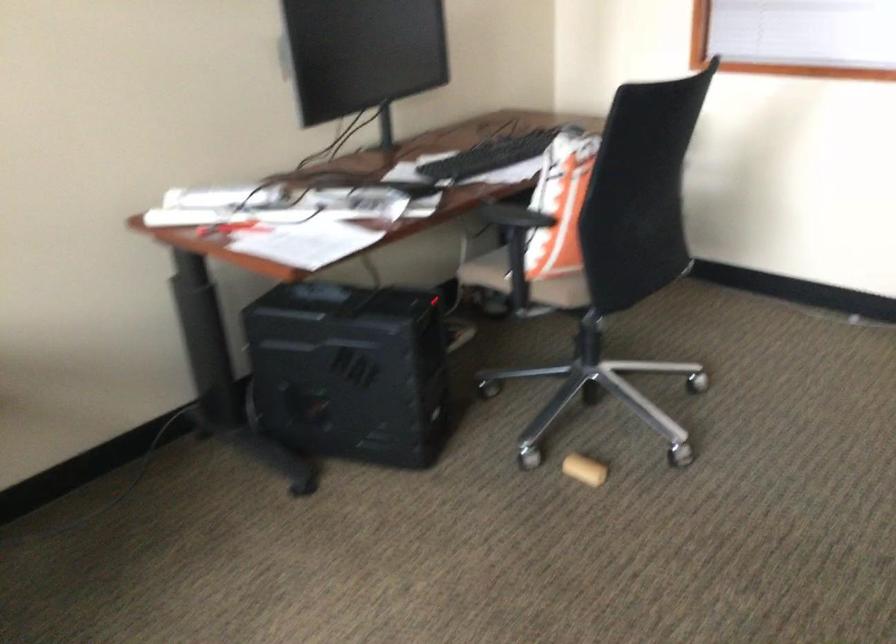
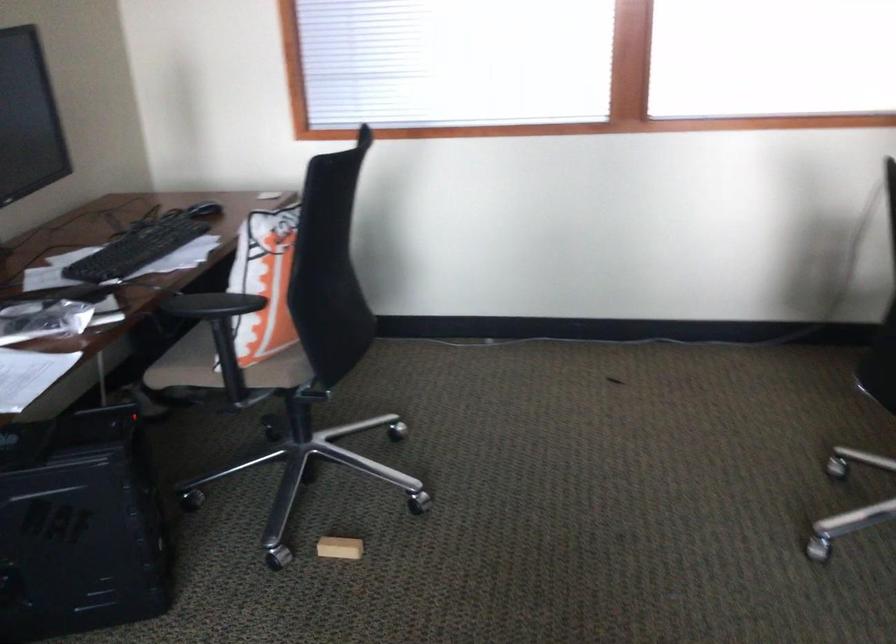
Find the pixel in the second image that matches (x=504, y=216) in the first image.

(211, 305)